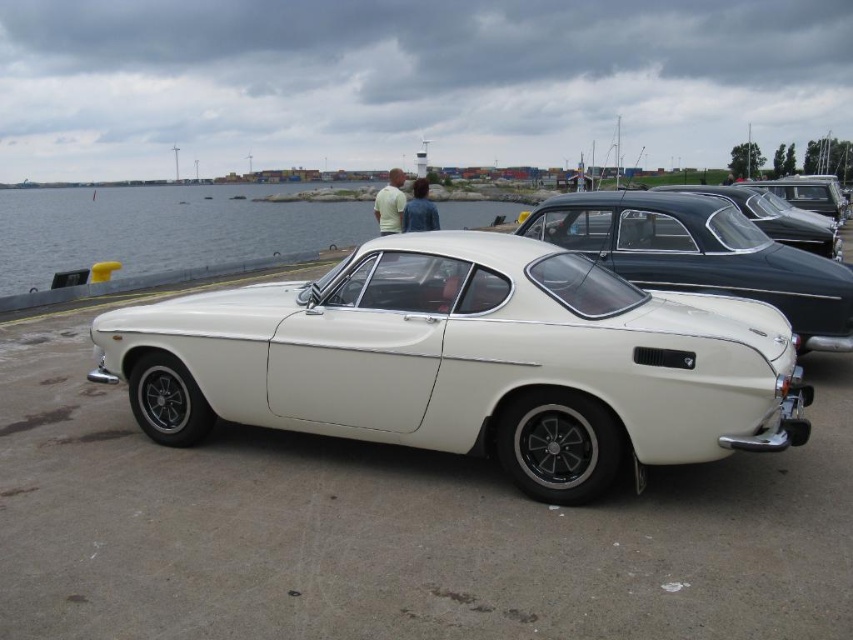
You are a photographer planning to take a photo of the shiny black car at right and the clear water at center. Based on their positions, which object will appear larger in the photo?

The clear water at center will appear larger in the photo because it is taller than the shiny black car at right.

You are a photographer planning to capture the shiny black car at right and the clear water at center in a single shot. Based on their positions, can you determine which object is closer to the camera?

The clear water at center is in front of the shiny black car at right, so the clear water at center is closer to the camera than the shiny black car at right.